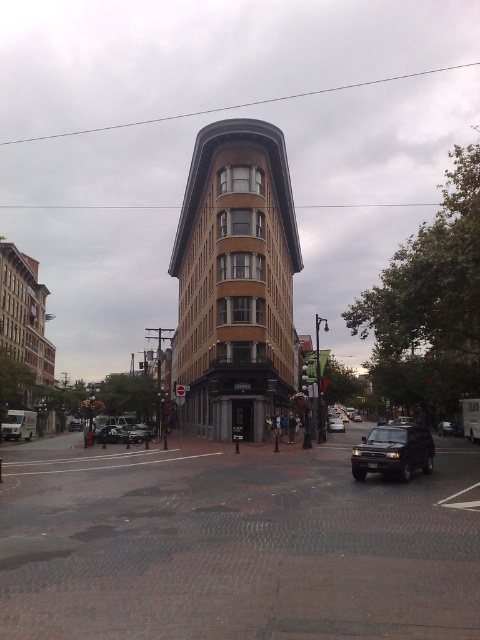
You are a delivery person standing at the camera position, and you need to park your shiny black suv at lower right. The parking spot you want to use is 18 meters long. Can your vehicle fit into the parking spot?

The shiny black suv at lower right is 17.40 meters from camera. Since the parking spot is 18 meters long, the vehicle can fit as it is shorter than the parking space.